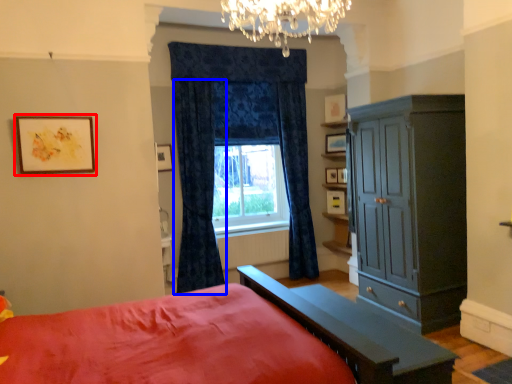
Question: Which of the following is the closest to the observer, picture frame (highlighted by a red box) or curtain (highlighted by a blue box)?

Choices:
 (A) picture frame
 (B) curtain

Answer: (A)